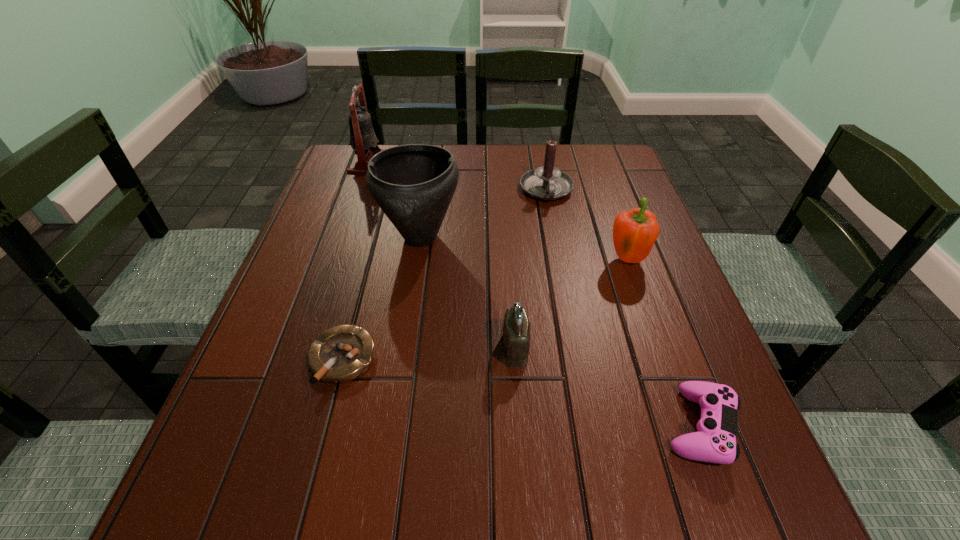
Where is `ashtray present at the left edge`? The image size is (960, 540). ashtray present at the left edge is located at coordinates (343, 353).

At what (x,y) coordinates should I click in order to perform the action: click on pepper situated at the right edge. Please return your answer as a coordinate pair (x, y). This screenshot has width=960, height=540. Looking at the image, I should click on (635, 231).

The height and width of the screenshot is (540, 960). What are the coordinates of `control present at the right edge` in the screenshot? It's located at (715, 442).

The height and width of the screenshot is (540, 960). What are the coordinates of `object present at the far left corner` in the screenshot? It's located at [363, 140].

In the image, there is a desktop. Identify the location of free space at the near edge. (300, 521).

In the image, there is a desktop. Where is `vacant space at the left edge`? The height and width of the screenshot is (540, 960). vacant space at the left edge is located at coordinates (281, 394).

Where is `free spot at the right edge of the desktop`? free spot at the right edge of the desktop is located at coordinates (639, 274).

Locate an element on the screen. The width and height of the screenshot is (960, 540). free space at the near right corner of the desktop is located at coordinates (689, 524).

Where is `free space between the pepper and the bell`? free space between the pepper and the bell is located at coordinates [497, 211].

Identify the location of blank region between the urn and the candle. This screenshot has width=960, height=540. (483, 214).